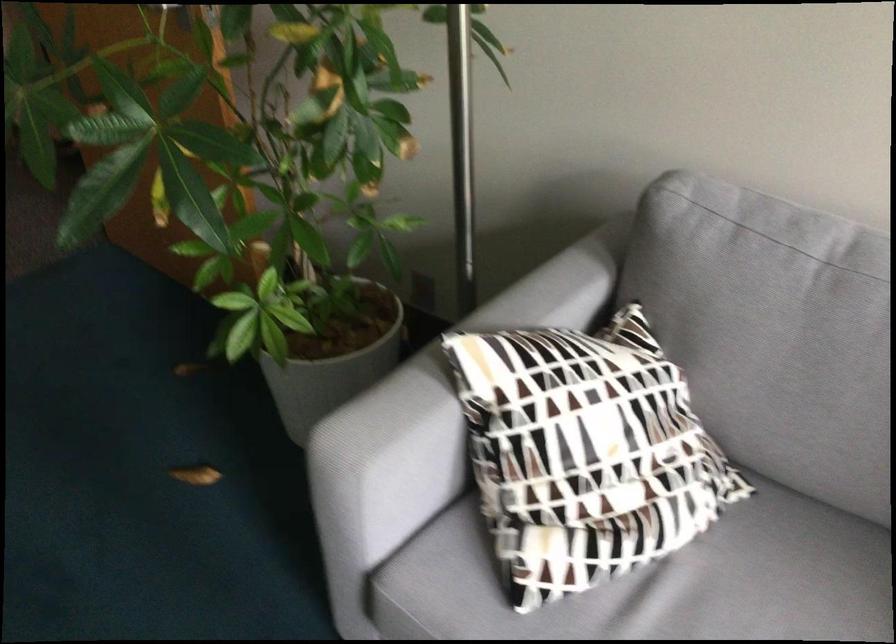
Where is `sofa sitting surface`? The height and width of the screenshot is (644, 896). sofa sitting surface is located at coordinates (780, 565).